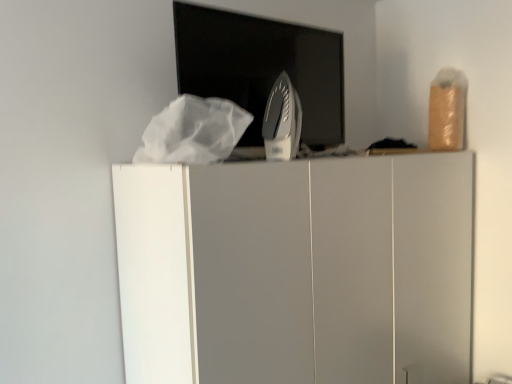
Question: Is silver metallic iron at center aimed at metallic iron at center?

Choices:
 (A) yes
 (B) no

Answer: (B)

Question: From a real-world perspective, does silver metallic iron at center stand above metallic iron at center?

Choices:
 (A) no
 (B) yes

Answer: (A)

Question: Is silver metallic iron at center positioned far away from metallic iron at center?

Choices:
 (A) no
 (B) yes

Answer: (A)

Question: From a real-world perspective, does silver metallic iron at center sit lower than metallic iron at center?

Choices:
 (A) yes
 (B) no

Answer: (A)

Question: Does silver metallic iron at center have a greater width compared to metallic iron at center?

Choices:
 (A) no
 (B) yes

Answer: (B)

Question: Can you confirm if silver metallic iron at center is smaller than metallic iron at center?

Choices:
 (A) yes
 (B) no

Answer: (A)

Question: Can you confirm if metallic iron at center is positioned to the left of white matte cabinet at center?

Choices:
 (A) no
 (B) yes

Answer: (B)

Question: Is metallic iron at center with white matte cabinet at center?

Choices:
 (A) yes
 (B) no

Answer: (B)

Question: Would you say metallic iron at center is a long distance from white matte cabinet at center?

Choices:
 (A) yes
 (B) no

Answer: (B)

Question: From the image's perspective, does metallic iron at center appear lower than white matte cabinet at center?

Choices:
 (A) no
 (B) yes

Answer: (A)

Question: Considering the relative sizes of metallic iron at center and white matte cabinet at center in the image provided, is metallic iron at center shorter than white matte cabinet at center?

Choices:
 (A) no
 (B) yes

Answer: (B)

Question: Is metallic iron at center positioned beyond the bounds of white matte cabinet at center?

Choices:
 (A) yes
 (B) no

Answer: (A)

Question: From a real-world perspective, is white matte cabinet at center on silver metallic iron at center?

Choices:
 (A) yes
 (B) no

Answer: (B)